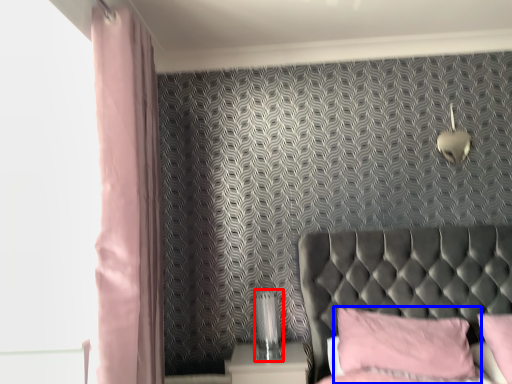
Question: Which object appears closest to the camera in this image, table lamp (highlighted by a red box) or pillow (highlighted by a blue box)?

Choices:
 (A) table lamp
 (B) pillow

Answer: (B)